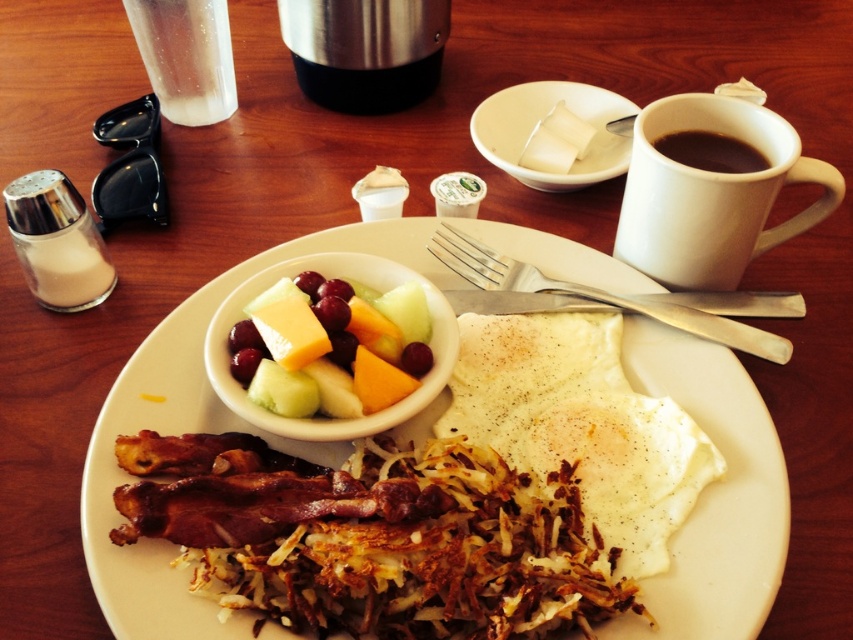
You are looking at the breakfast table setup. There are two points marked on the image. Which point, point 1 at coordinates (642, 515) or point 2 at coordinates (717, 138), is closer to you?

Point 1 at coordinates (642, 515) is closer to the viewer than point 2 at coordinates (717, 138).